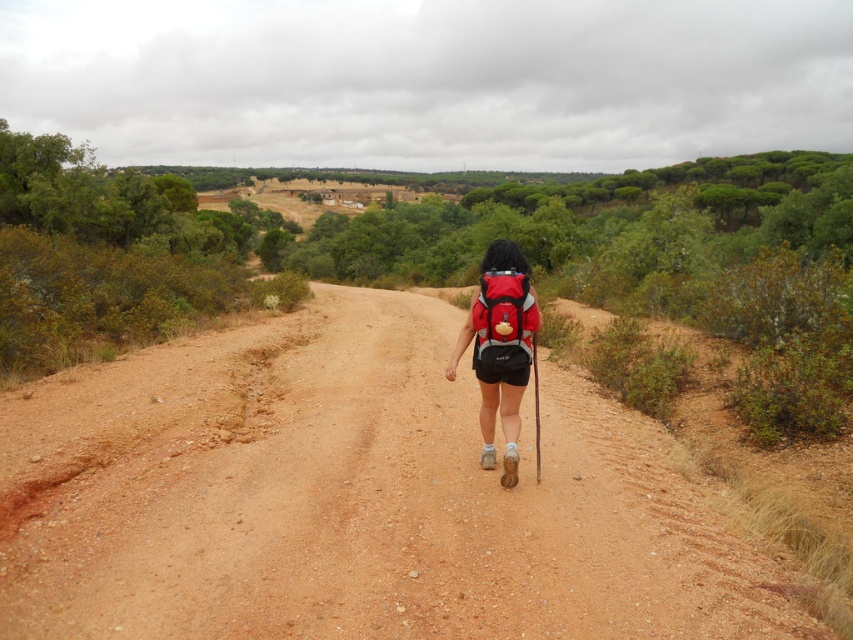
Question: Does brown dirt track at center come in front of red fabric backpack at center?

Choices:
 (A) no
 (B) yes

Answer: (B)

Question: Which of the following is the farthest from the observer?

Choices:
 (A) (483, 307)
 (B) (495, 289)
 (C) (305, 442)

Answer: (C)

Question: Which point appears farthest from the camera in this image?

Choices:
 (A) (488, 316)
 (B) (483, 368)
 (C) (757, 588)

Answer: (B)

Question: Can you confirm if brown dirt track at center is positioned below matte red backpack at center?

Choices:
 (A) yes
 (B) no

Answer: (A)

Question: Which point is closer to the camera?

Choices:
 (A) (151, 349)
 (B) (498, 381)

Answer: (B)

Question: Does brown dirt track at center have a lesser width compared to matte red backpack at center?

Choices:
 (A) yes
 (B) no

Answer: (B)